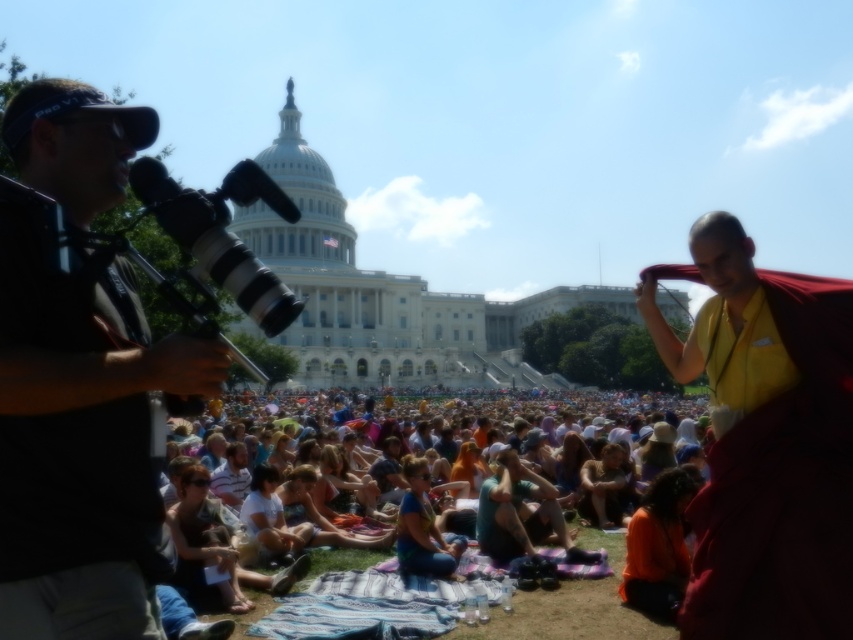
Is point (146, 552) behind point (572, 602)?

No, it is not.

Who is more distant from viewer, (131, 372) or (363, 554)?

Point (363, 554)

Does point (135, 365) come closer to viewer compared to point (534, 595)?

Yes, it is.

Find the location of a particular element. The height and width of the screenshot is (640, 853). black fabric camera at left is located at coordinates (80, 449).

Measure the distance from maroon silk robe at center to multicolored fabric at center.

They are 19.84 meters apart.

Is maroon silk robe at center to the left of multicolored fabric at center from the viewer's perspective?

In fact, maroon silk robe at center is to the right of multicolored fabric at center.

Measure the distance between point (x=834, y=378) and camera.

Point (x=834, y=378) is 55.49 meters away from camera.

Where is `maroon silk robe at center`? maroon silk robe at center is located at coordinates pyautogui.click(x=764, y=440).

Is black fabric camera at left taller than maroon silk robe at center?

Correct, black fabric camera at left is much taller as maroon silk robe at center.

Can you confirm if black fabric camera at left is thinner than maroon silk robe at center?

No, black fabric camera at left is not thinner than maroon silk robe at center.

Looking at this image, who is more forward, (135, 401) or (747, 609)?

Point (135, 401) is in front.

At what (x,y) coordinates should I click in order to perform the action: click on black fabric camera at left. Please return your answer as a coordinate pair (x, y). This screenshot has width=853, height=640. Looking at the image, I should click on (80, 449).